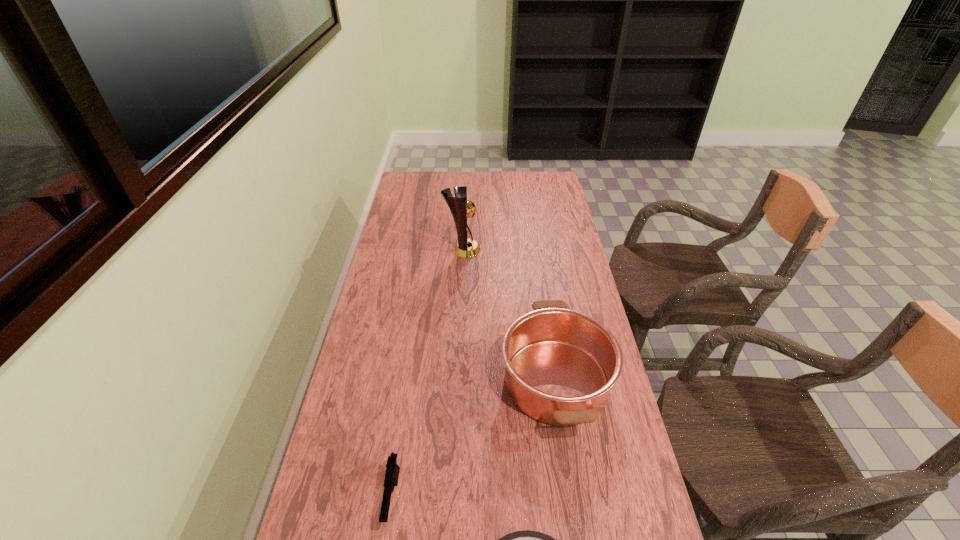
I want to click on vacant space that satisfies the following two spatial constraints: 1. at the front of the tallest object, where the globe is visible; 2. on the front-facing side of the pistol, so click(450, 498).

You are a GUI agent. You are given a task and a screenshot of the screen. Output one action in this format:
    pyautogui.click(x=<x>, y=<y>)
    Task: Click on the free location that satisfies the following two spatial constraints: 1. at the front of the third shortest object, where the globe is visible; 2. on the left side of the tallest object
    
    Given the screenshot: What is the action you would take?
    pyautogui.click(x=456, y=381)

This screenshot has height=540, width=960. I want to click on blank area in the image that satisfies the following two spatial constraints: 1. at the front of the second farthest object, where the globe is visible; 2. on the left side of the farthest object, so (456, 381).

I want to click on vacant area in the image that satisfies the following two spatial constraints: 1. on the back side of the saucepan; 2. at the front of the farthest object, where the globe is visible, so click(x=536, y=250).